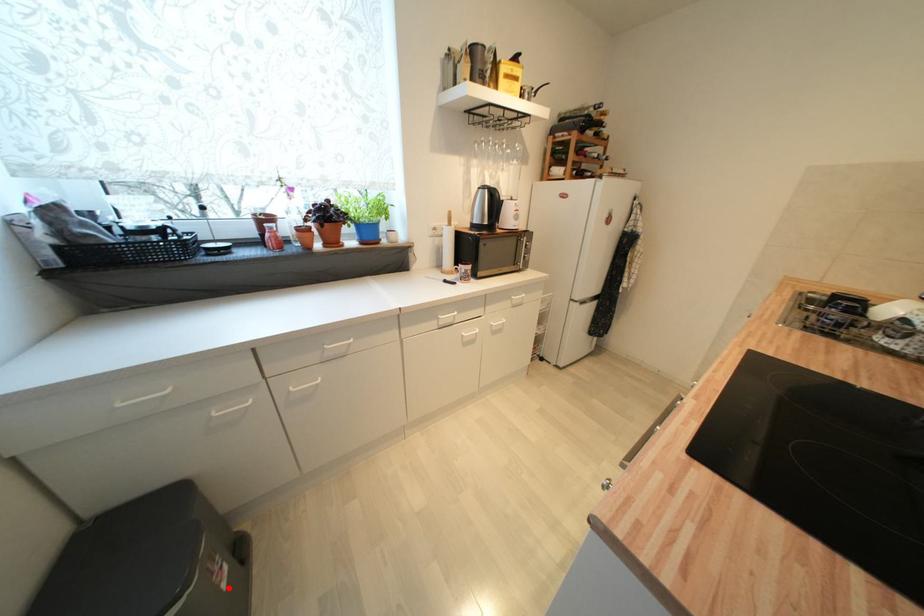
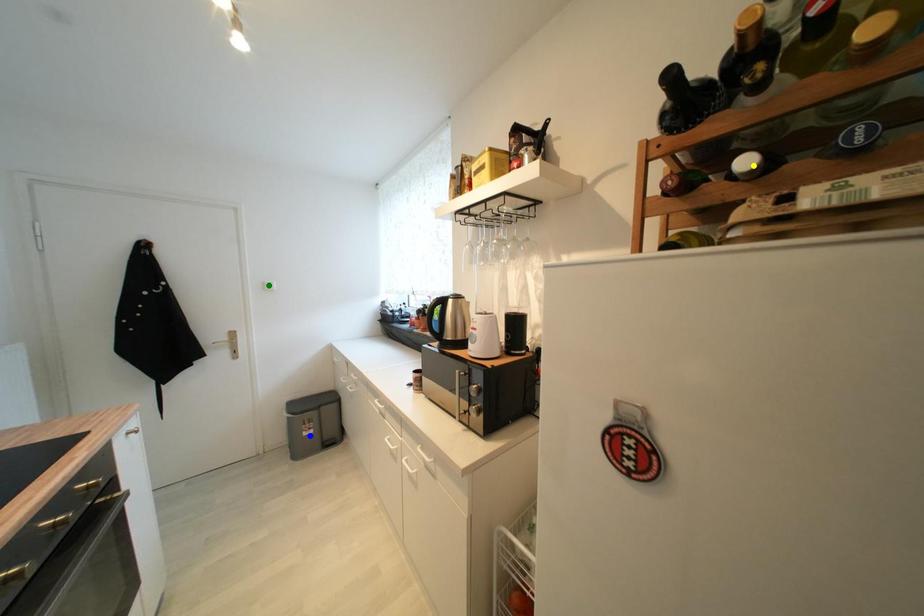
Question: I am providing you with two images of the same scene from different viewpoints. A red point is marked on the first image. You are given multiple points on the second image. Which point in image 2 represents the same 3d spot as the red point in image 1?

Choices:
 (A) green point
 (B) yellow point
 (C) blue point

Answer: (C)